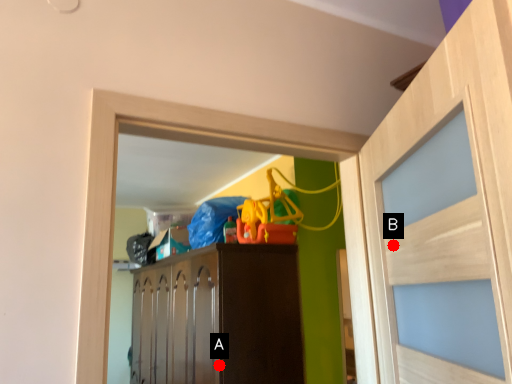
Question: Two points are circled on the image, labeled by A and B beside each circle. Which point is further to the camera?

Choices:
 (A) A is further
 (B) B is further

Answer: (A)